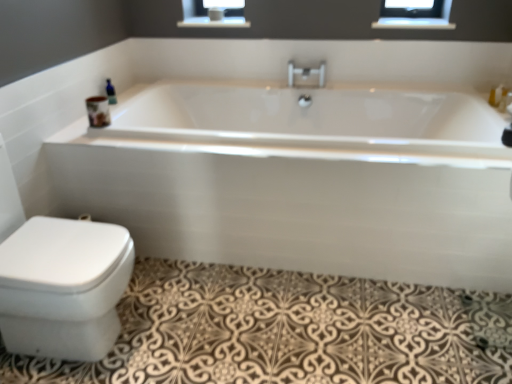
What are the coordinates of `vacant space situated above brown textured bath mat at lower left (from a real-world perspective)` in the screenshot? It's located at (284, 319).